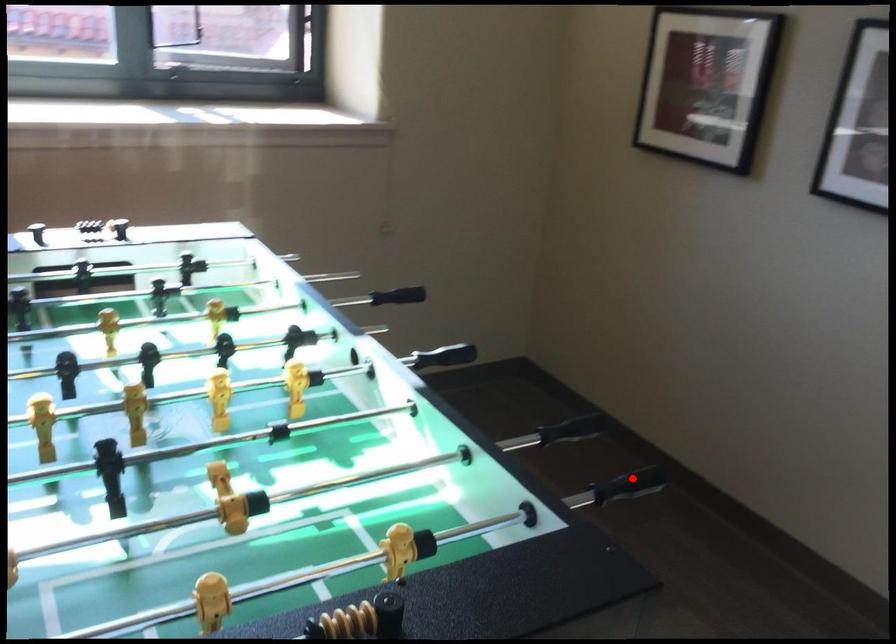
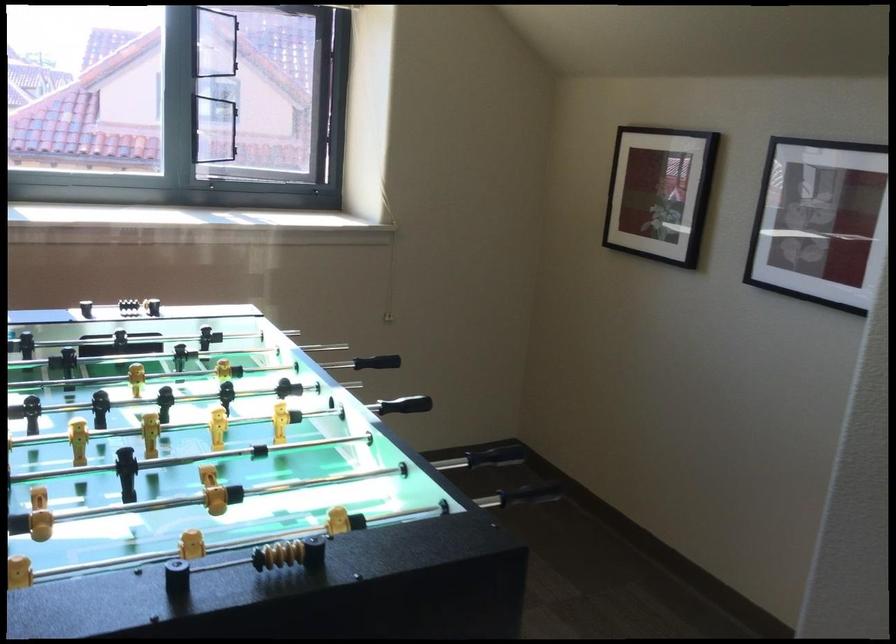
Question: I am providing you with two images of the same scene from different viewpoints. Given a red point in image1, look at the same physical point in image2. Is it:

Choices:
 (A) Closer to the viewpoint
 (B) Farther from the viewpoint

Answer: (B)